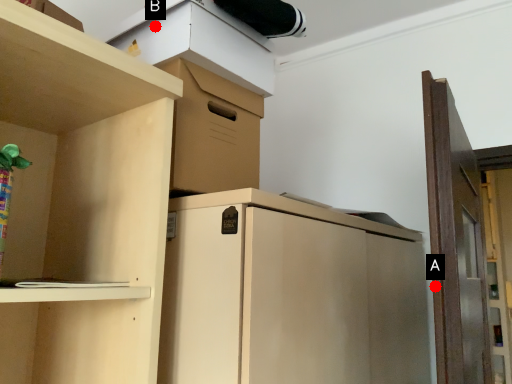
Question: Two points are circled on the image, labeled by A and B beside each circle. Which point is farther to the camera?

Choices:
 (A) A is further
 (B) B is further

Answer: (B)